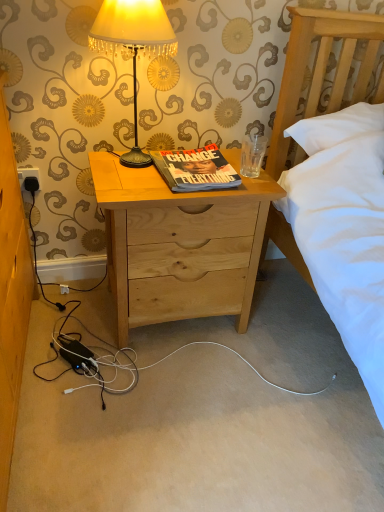
In order to click on vacant region above natural wood nightstand at center (from a real-world perspective) in this screenshot , I will do (179, 174).